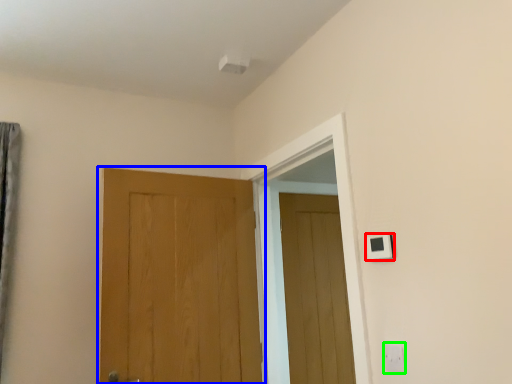
Question: Estimate the real-world distances between objects in this image. Which object is farther from light switch (highlighted by a red box), door (highlighted by a blue box) or electric outlet (highlighted by a green box)?

Choices:
 (A) door
 (B) electric outlet

Answer: (A)